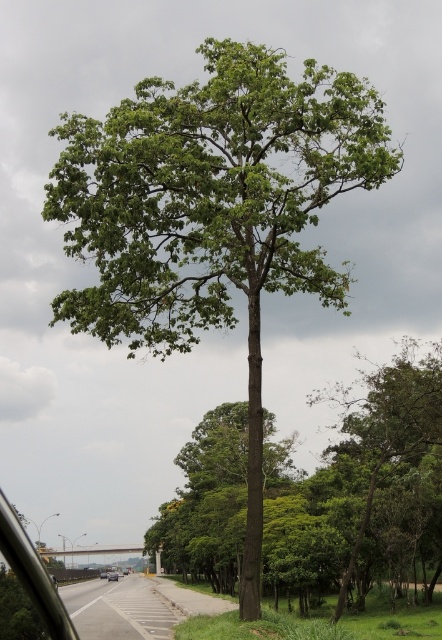
Question: Which of the following is the farthest from the observer?

Choices:
 (A) green leafy tree at center
 (B) silver metallic car at center

Answer: (B)

Question: Is the position of silver metallic sedan at center more distant than that of silver metallic car at center?

Choices:
 (A) yes
 (B) no

Answer: (B)

Question: Is green leafy tree at center below silver metallic car at center?

Choices:
 (A) no
 (B) yes

Answer: (A)

Question: Based on their relative distances, which object is farther from the green leafy tree at center?

Choices:
 (A) silver metallic car at center
 (B) asphalt road at lower left
 (C) transparent glass car window at lower left
 (D) silver metallic sedan at center

Answer: (A)

Question: Is asphalt road at lower left to the left of silver metallic sedan at center from the viewer's perspective?

Choices:
 (A) no
 (B) yes

Answer: (A)

Question: Estimate the real-world distances between objects in this image. Which object is farther from the green leafy tree at center?

Choices:
 (A) transparent glass car window at lower left
 (B) silver metallic car at center
 (C) silver metallic sedan at center
 (D) asphalt road at lower left

Answer: (B)